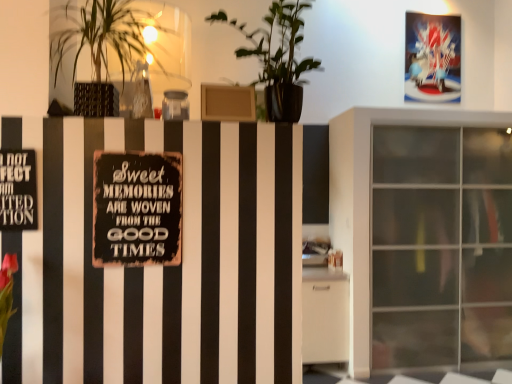
Question: Considering the relative positions of rusty metal sign at center and black metal sign at left in the image provided, is rusty metal sign at center to the left or to the right of black metal sign at left?

Choices:
 (A) right
 (B) left

Answer: (A)

Question: Does point (173, 183) appear closer or farther from the camera than point (25, 210)?

Choices:
 (A) farther
 (B) closer

Answer: (A)

Question: Estimate the real-world distances between objects in this image. Which object is closer to the shiny plastic postcard at upper right?

Choices:
 (A) green matte plant at upper center, the second houseplant viewed from the left
 (B) black metal sign at left
 (C) rusty metal sign at center
 (D) transparent glass cabinet at right
 (E) green leafy plant at upper left, which appears as the second houseplant when viewed from the right

Answer: (D)

Question: Which object is positioned closest to the black metal sign at left?

Choices:
 (A) shiny plastic postcard at upper right
 (B) green leafy plant at upper left, which appears as the second houseplant when viewed from the right
 (C) transparent glass cabinet at right
 (D) green matte plant at upper center, which appears as the first houseplant when viewed from the right
 (E) rusty metal sign at center

Answer: (E)